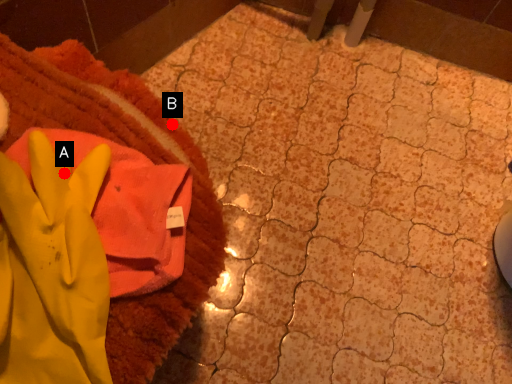
Question: Two points are circled on the image, labeled by A and B beside each circle. Which point is farther from the camera taking this photo?

Choices:
 (A) A is further
 (B) B is further

Answer: (B)